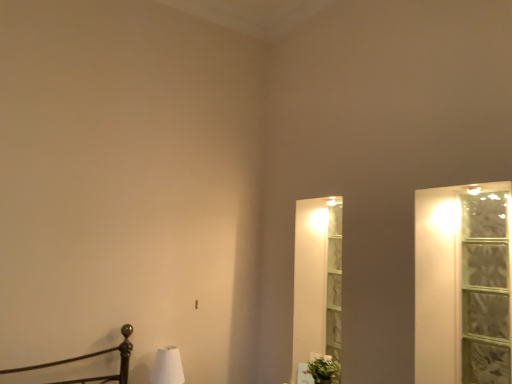
The width and height of the screenshot is (512, 384). I want to click on free location above clear glass window at right (from a real-world perspective), so pyautogui.click(x=485, y=200).